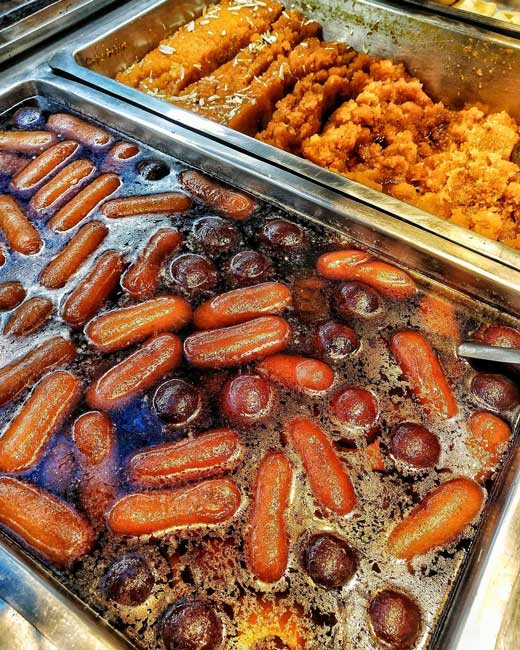
Locate an element on the screen. This screenshot has width=520, height=650. serving spoon is located at coordinates (501, 358).